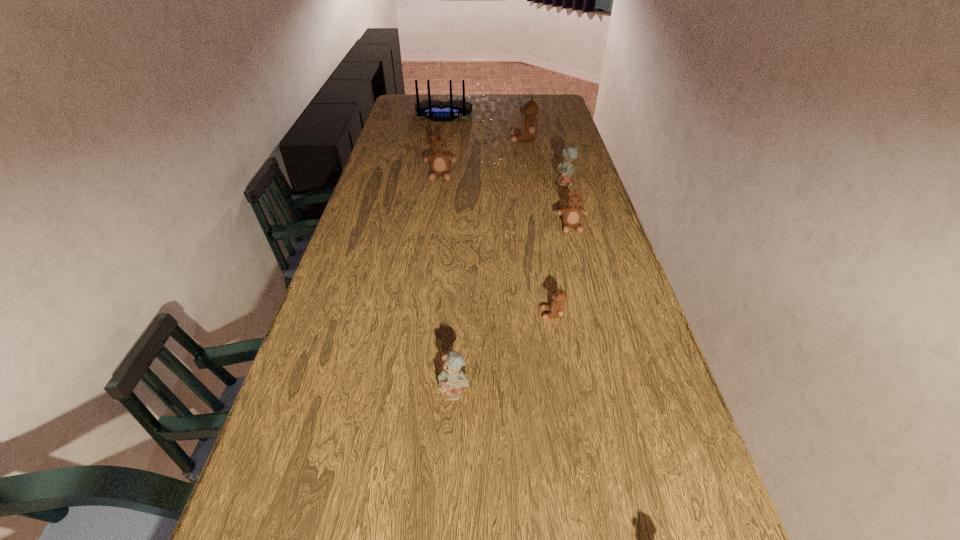
In the image, there is a desktop. Identify the location of vacant space at the far edge. The width and height of the screenshot is (960, 540). (503, 111).

Find the location of `vacant space at the left edge of the desktop`. vacant space at the left edge of the desktop is located at coordinates (371, 180).

At what (x,y) coordinates should I click in order to perform the action: click on free space at the right edge. Please return your answer as a coordinate pair (x, y). The height and width of the screenshot is (540, 960). Looking at the image, I should click on (631, 419).

The image size is (960, 540). I want to click on vacant space at the far right corner, so click(x=557, y=94).

Find the location of `free area in between the nearest object and the fifth farthest object`. free area in between the nearest object and the fifth farthest object is located at coordinates (513, 309).

Locate an element on the screen. vacant region between the second biggest brown teddy bear and the shortest teddy bear is located at coordinates (496, 245).

You are a GUI agent. You are given a task and a screenshot of the screen. Output one action in this format:
    pyautogui.click(x=<x>, y=<y>)
    Task: Click on the free space that is in between the tallest teddy bear and the farther blue teddy bear
    
    Given the screenshot: What is the action you would take?
    pyautogui.click(x=544, y=161)

Image resolution: width=960 pixels, height=540 pixels. In order to click on free space between the third nearest brown teddy bear and the nearer blue teddy bear in this screenshot , I will do `click(447, 284)`.

Locate an element on the screen. Image resolution: width=960 pixels, height=540 pixels. empty space between the farthest object and the left blue teddy bear is located at coordinates (449, 253).

You are a GUI agent. You are given a task and a screenshot of the screen. Output one action in this format:
    pyautogui.click(x=<x>, y=<y>)
    Task: Click on the empty location between the farthest teddy bear and the farther blue teddy bear
    
    Given the screenshot: What is the action you would take?
    pyautogui.click(x=544, y=161)